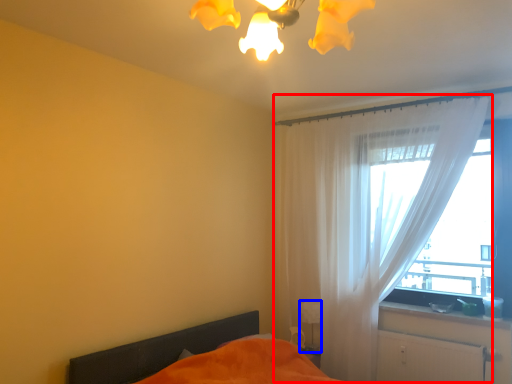
Question: Which object is further to the camera taking this photo, curtain (highlighted by a red box) or table lamp (highlighted by a blue box)?

Choices:
 (A) curtain
 (B) table lamp

Answer: (B)